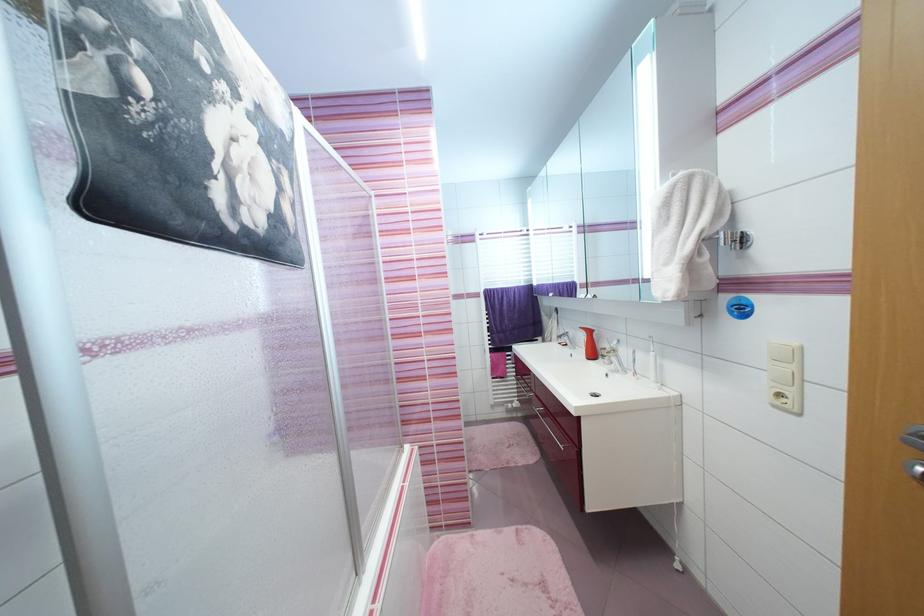
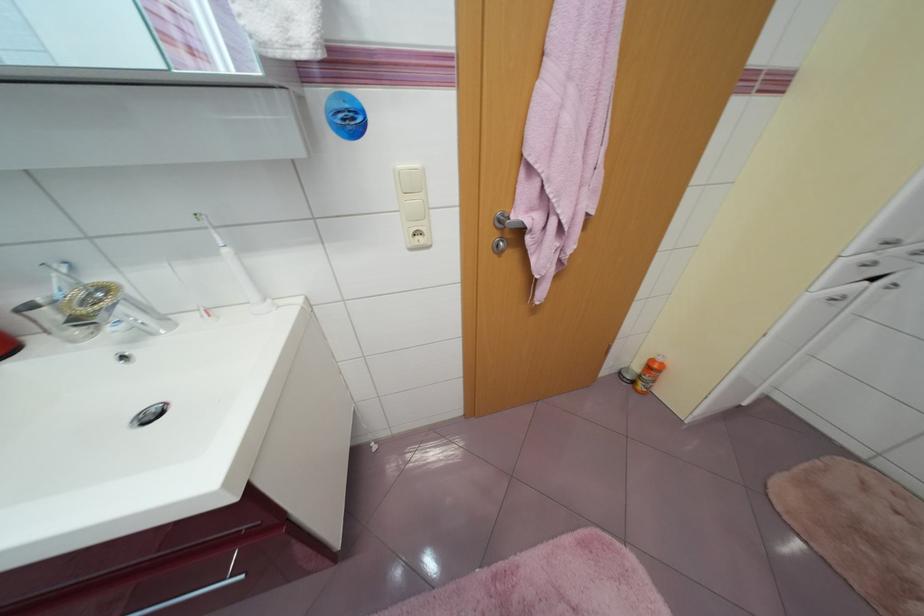
In the second image, find the point that corresponds to [789,400] in the first image.

(423, 238)